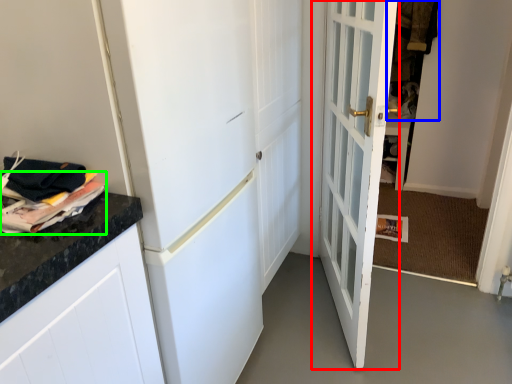
Question: Which object is positioned closest to door (highlighted by a red box)? Select from laundry (highlighted by a blue box) and magazine (highlighted by a green box).

Choices:
 (A) laundry
 (B) magazine

Answer: (B)